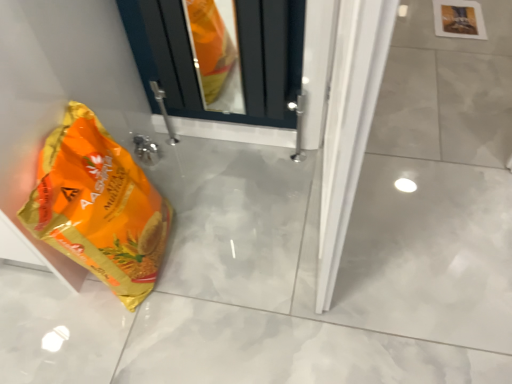
Describe the element at coordinates (98, 206) in the screenshot. I see `orange matte plastic bag at lower left` at that location.

Locate an element on the screen. The width and height of the screenshot is (512, 384). orange matte plastic bag at lower left is located at coordinates (98, 206).

This screenshot has width=512, height=384. I want to click on orange matte plastic bag at lower left, so click(98, 206).